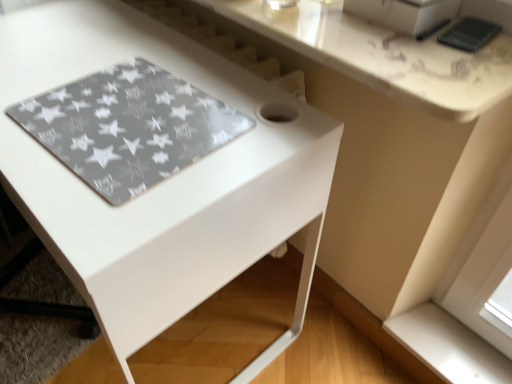
You are a GUI agent. You are given a task and a screenshot of the screen. Output one action in this format:
    pyautogui.click(x=<x>, y=<y>)
    Task: Click on the free space in front of black matte phone at upper right
    The height and width of the screenshot is (384, 512).
    Given the screenshot: What is the action you would take?
    pyautogui.click(x=466, y=73)